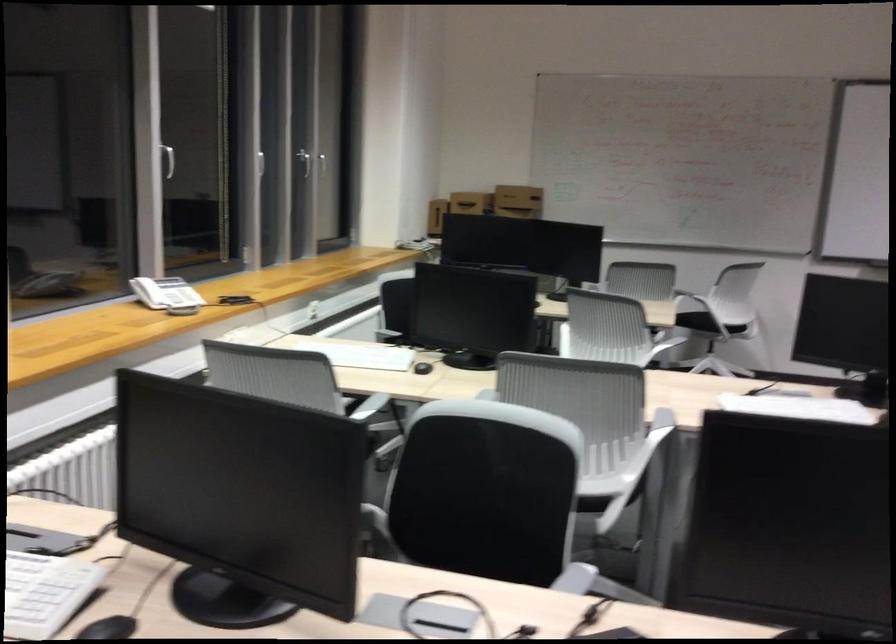
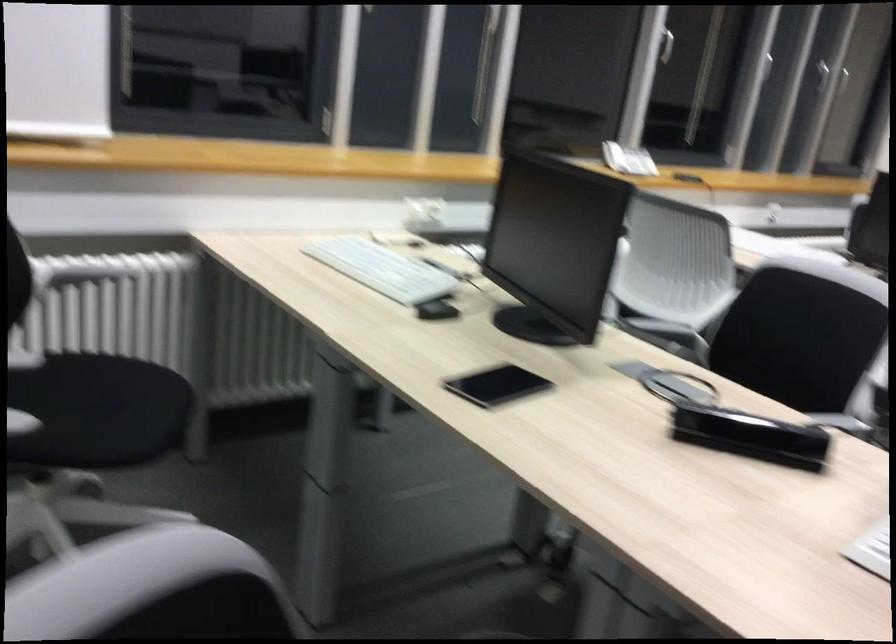
The point at (x=159, y=301) is marked in the first image. Where is the corresponding point in the second image?

(614, 156)